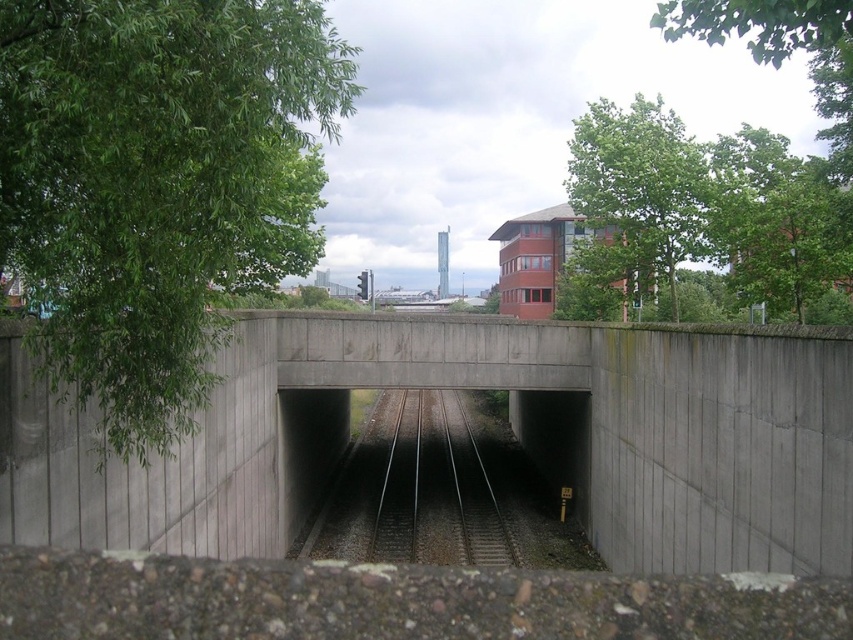
You are a photographer planning to capture the railway underpass scene. You want to ensure that the green leafy tree at left and the white textured water tower at center are both visible in your shot. Given their sizes, which object will occupy more space in the photo?

The green leafy tree at left will occupy more space in the photo since its width is larger than the white textured water tower at center.

You are standing at the railway underpass and want to determine the relative positions of two points marked in the scene. Which point is closer to you, point 1 at coordinates point 1 at coordinates point (758, 476) or point 2 at coordinates point (717, 19)?

Point (758, 476) is closer to you than point (717, 19) because it is further to the viewer according to the description.

You are standing at the railway underpass and want to take a photo of the green leafy tree at left. If your camera can focus on objects up to 15 feet away, will you need to adjust your position to get a clear shot?

The green leafy tree at left is 12.58 feet away from the viewer. Since your camera can focus up to 15 feet, you don not need to move. Just take the photo as is.